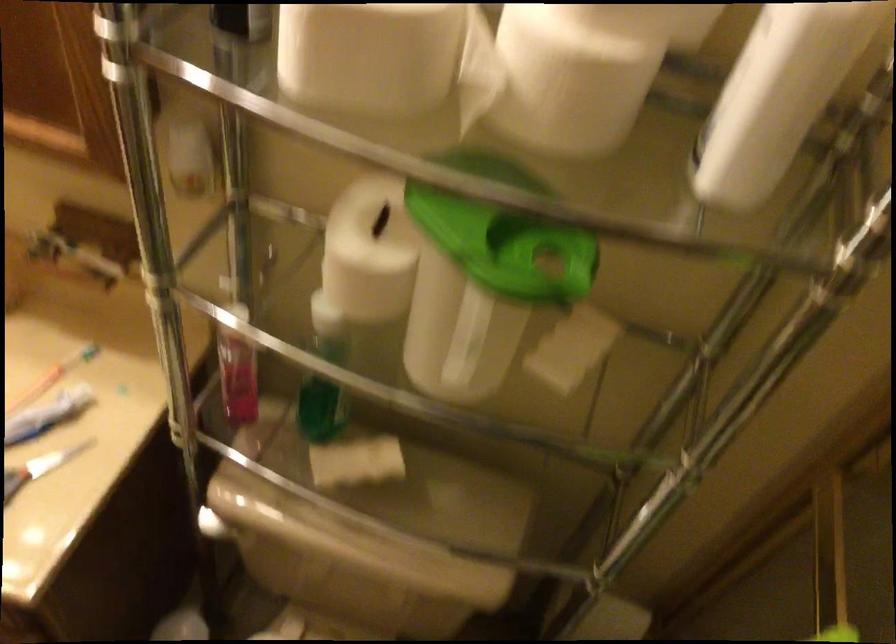
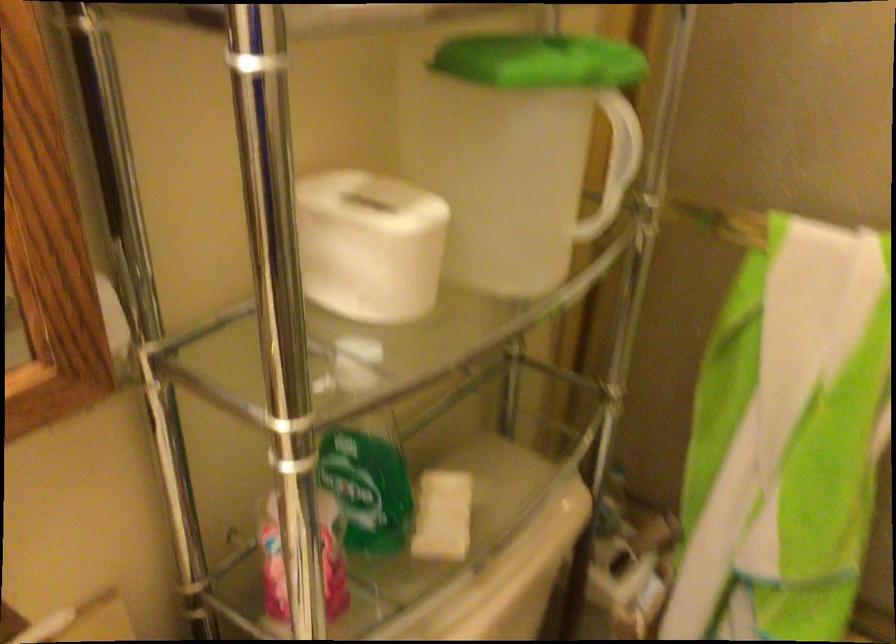
Question: The camera is either moving clockwise (left) or counter-clockwise (right) around the object. The first image is from the beginning of the video and the second image is from the end. Is the camera moving left or right when shooting the video?

Choices:
 (A) Left
 (B) Right

Answer: (A)